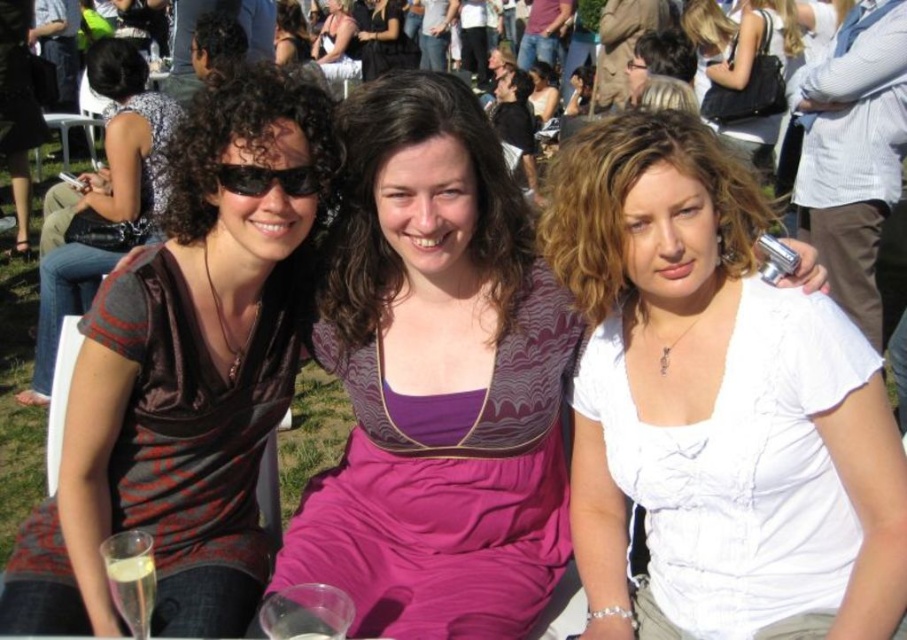
You are a photographer at the event and want to arrange the two women in a line so that their dresses are visible. Given that the purple satin dress at center and the maroon satin dress at center are in the scene, which dress should be placed in front to ensure the other is still visible?

The maroon satin dress at center should be placed in front because the purple satin dress at center is taller. This way, the taller purple dress will be visible behind the shorter maroon dress.

In the scene of a lively outdoor gathering with three women seated in the foreground, where exactly is the white matte shirt at center located?

The white matte shirt at center is located at point 0.620 on the x axis and 0.788 on the y axis.

You are a photographer at the event and want to capture a photo that includes both the purple satin dress at center and the maroon satin dress at center. Which dress should you position to the left side of your frame to ensure both are included?

To include both the purple satin dress at center and the maroon satin dress at center in your photo, position the purple satin dress at center to the left side of your frame since it is already to the left of the maroon satin dress at center.